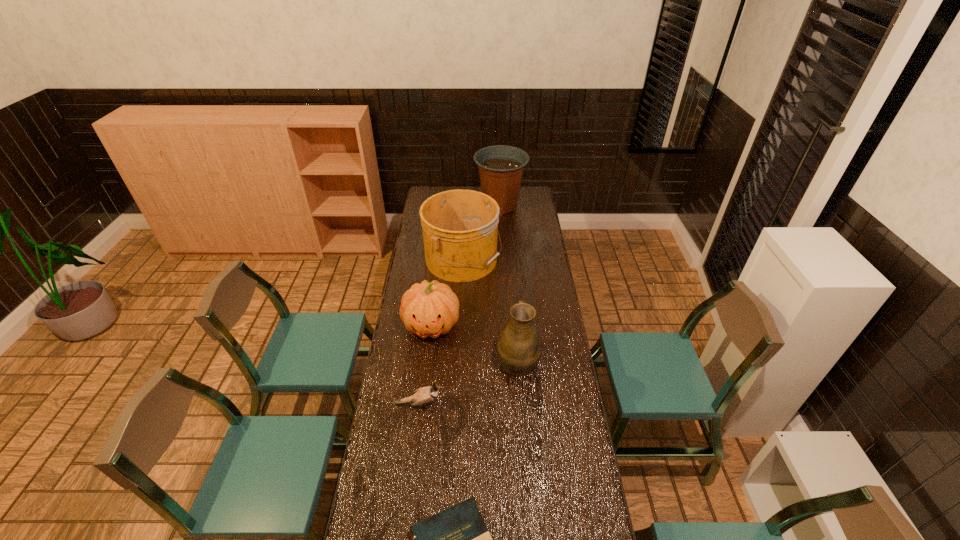
At what (x,y) coordinates should I click in order to perform the action: click on vacant space located 0.050m on the handle side of the pitcher. Please return your answer as a coordinate pair (x, y). The height and width of the screenshot is (540, 960). Looking at the image, I should click on (516, 332).

The height and width of the screenshot is (540, 960). What are the coordinates of `vacant space located on the carved face of the pumpkin` in the screenshot? It's located at (426, 376).

You are a GUI agent. You are given a task and a screenshot of the screen. Output one action in this format:
    pyautogui.click(x=<x>, y=<y>)
    Task: Click on the free location located at the face of the second shortest object
    The width and height of the screenshot is (960, 540).
    Given the screenshot: What is the action you would take?
    pyautogui.click(x=510, y=405)

Locate an element on the screen. object that is at the far edge is located at coordinates (501, 167).

Where is `bucket that is at the left edge`? bucket that is at the left edge is located at coordinates (460, 227).

Identify the location of pumpkin that is positioned at the left edge. This screenshot has width=960, height=540. (428, 309).

Identify the location of bird at the left edge. The width and height of the screenshot is (960, 540). (425, 395).

This screenshot has height=540, width=960. I want to click on flowerpot positioned at the right edge, so (501, 167).

Where is `pitcher that is at the right edge`? The height and width of the screenshot is (540, 960). pitcher that is at the right edge is located at coordinates (520, 347).

At what (x,y) coordinates should I click in order to perform the action: click on object located in the far right corner section of the desktop. Please return your answer as a coordinate pair (x, y). The image size is (960, 540). Looking at the image, I should click on (501, 167).